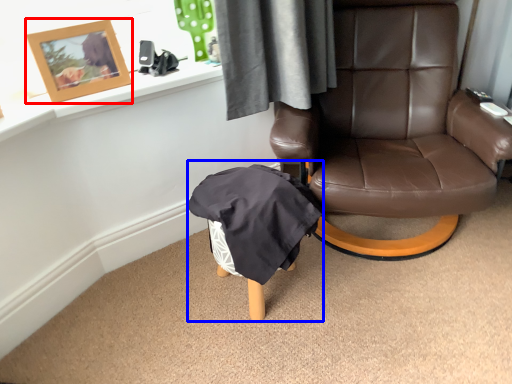
Question: Among these objects, which one is farthest to the camera, picture frame (highlighted by a red box) or bean bag chair (highlighted by a blue box)?

Choices:
 (A) picture frame
 (B) bean bag chair

Answer: (A)